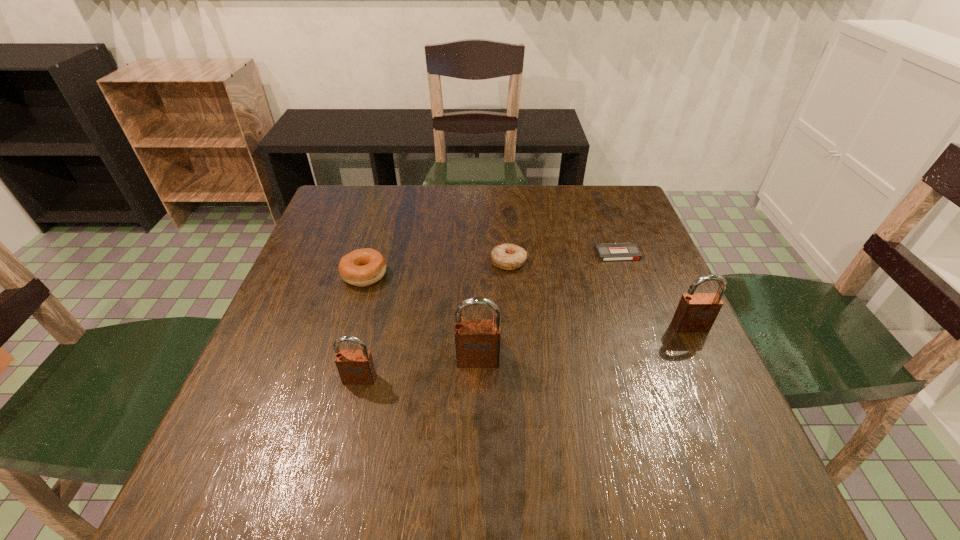
Find the location of `vacant region located on the front-facing side of the nearest object`. vacant region located on the front-facing side of the nearest object is located at coordinates (347, 433).

You are a GUI agent. You are given a task and a screenshot of the screen. Output one action in this format:
    pyautogui.click(x=<x>, y=<y>)
    Task: Click on the vacant space located 0.120m on the front-facing side of the second nearest object
    The image size is (960, 540).
    Given the screenshot: What is the action you would take?
    pyautogui.click(x=478, y=423)

Locate an element on the screen. The height and width of the screenshot is (540, 960). vacant space located on the front-facing side of the rightmost padlock is located at coordinates (709, 367).

Locate an element on the screen. vacant position located 0.140m on the back of the bagel is located at coordinates (378, 228).

At what (x,y) coordinates should I click in order to perform the action: click on free spot located 0.360m on the left of the fifth tallest object. Please return your answer as a coordinate pair (x, y). This screenshot has height=540, width=960. Looking at the image, I should click on (348, 261).

Find the location of a particular element. vacant space located on the left of the videotape is located at coordinates (453, 253).

This screenshot has height=540, width=960. I want to click on object that is at the left edge, so click(x=364, y=267).

The image size is (960, 540). I want to click on padlock that is at the right edge, so click(696, 312).

The width and height of the screenshot is (960, 540). I want to click on videotape that is at the right edge, so click(621, 251).

Identify the location of vacant region at the far edge of the desktop. (431, 204).